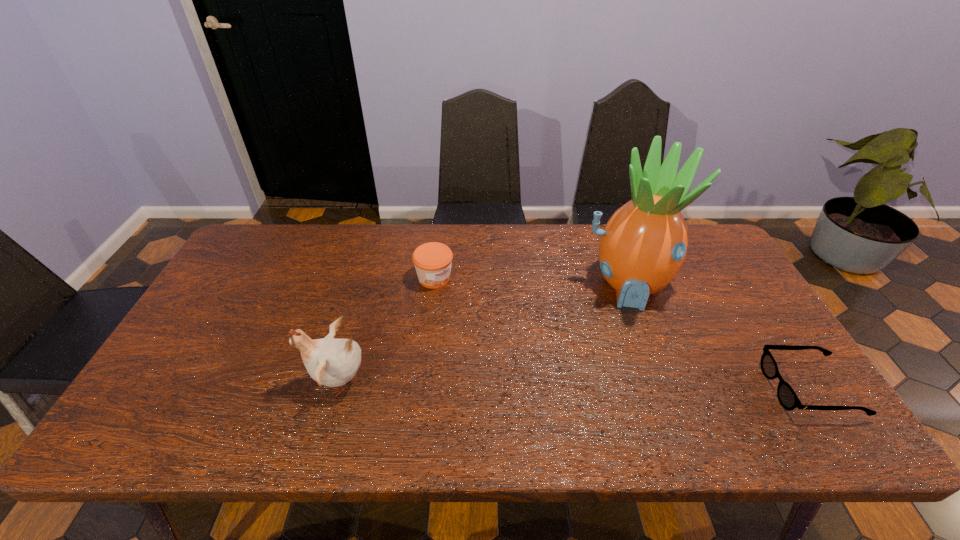
You are a GUI agent. You are given a task and a screenshot of the screen. Output one action in this format:
    pyautogui.click(x=<x>, y=<y>)
    Task: Click on the free point between the bird and the second shortest object
    Image resolution: width=960 pixels, height=540 pixels.
    Given the screenshot: What is the action you would take?
    pyautogui.click(x=387, y=329)

What are the coordinates of `empty space between the second object from left to right and the pineapple` in the screenshot? It's located at (531, 281).

Image resolution: width=960 pixels, height=540 pixels. I want to click on free area in between the rightmost object and the pineapple, so click(x=718, y=336).

Identify which object is the second closest to the third shortest object. Please provide its 2D coordinates. Your answer should be formatted as a tuple, i.e. [(x, y)], where the tuple contains the x and y coordinates of a point satisfying the conditions above.

[(643, 246)]

Where is `object that is the third closest to the rightmost object`? The image size is (960, 540). object that is the third closest to the rightmost object is located at coordinates (331, 362).

Find the location of a particular element. The width and height of the screenshot is (960, 540). vacant position in the image that satisfies the following two spatial constraints: 1. on the front side of the tallest object; 2. on the right side of the jam is located at coordinates (434, 284).

Locate an element on the screen. This screenshot has height=540, width=960. vacant space that satisfies the following two spatial constraints: 1. on the front side of the second object from right to left; 2. on the arms of the rightmost object is located at coordinates (665, 388).